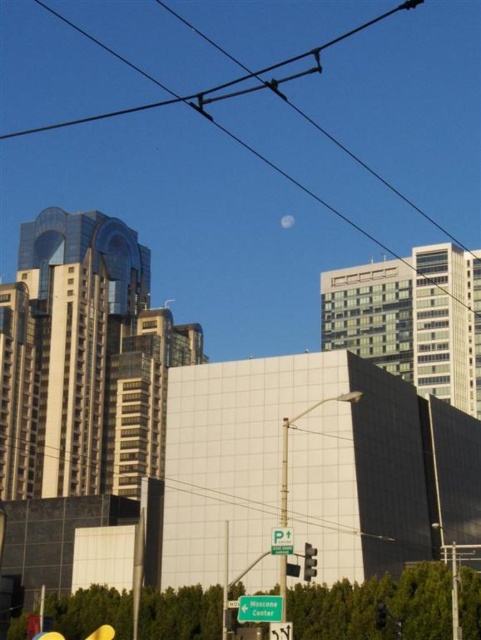
You are a delivery driver approaching the intersection and need to know which object is taller between the green plastic sign at center and the transparent glass traffic light at center. Can you tell me which one is taller?

The green plastic sign at center is taller than the transparent glass traffic light at center according to the description.

Based on the provided scene description, what are the coordinates of the black wire at upper center in the image?

The coordinates of the black wire at upper center are at point (215, 208).

Based on the photo, what is the position of the point labeled as point (215, 208) in the image?

The point labeled as point (215, 208) is located on the black wire at upper center.